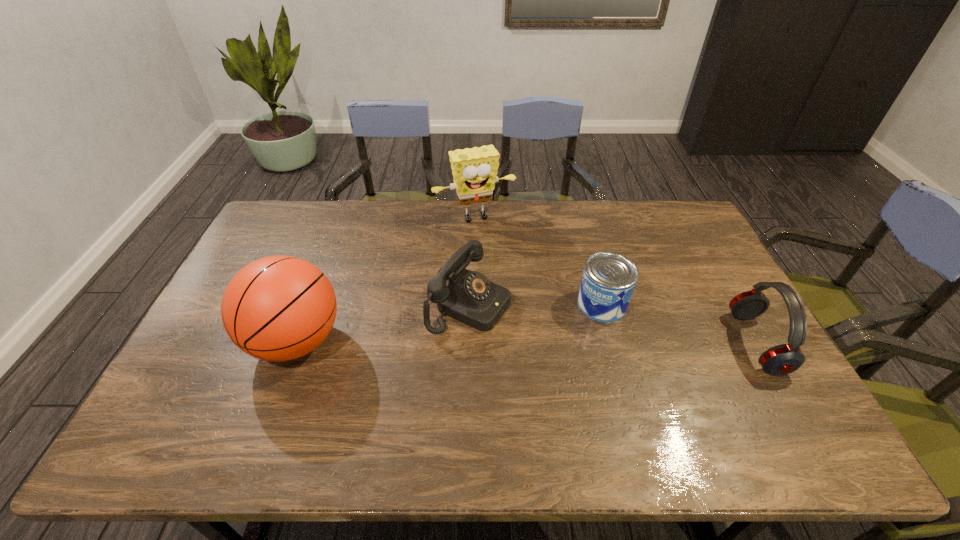
This screenshot has width=960, height=540. I want to click on blank region between the earphone and the fourth object from left to right, so click(679, 323).

Find the location of a particular element. The height and width of the screenshot is (540, 960). vacant area that lies between the basketball and the telephone is located at coordinates (383, 322).

Image resolution: width=960 pixels, height=540 pixels. In order to click on free space between the earphone and the second object from right to left in this screenshot , I will do `click(679, 323)`.

Image resolution: width=960 pixels, height=540 pixels. In order to click on vacant point located between the leftmost object and the telephone in this screenshot , I will do `click(383, 322)`.

Locate an element on the screen. The height and width of the screenshot is (540, 960). free space between the telephone and the rightmost object is located at coordinates (612, 323).

Where is `empty location between the telephone and the rightmost object`? The height and width of the screenshot is (540, 960). empty location between the telephone and the rightmost object is located at coordinates (612, 323).

Where is `blank region between the leftmost object and the farthest object`? Image resolution: width=960 pixels, height=540 pixels. blank region between the leftmost object and the farthest object is located at coordinates (386, 279).

Find the location of a particular element. The height and width of the screenshot is (540, 960). free spot between the basketball and the shortest object is located at coordinates (449, 322).

Identify which object is located as the fourth nearest to the earphone. Please provide its 2D coordinates. Your answer should be formatted as a tuple, i.e. [(x, y)], where the tuple contains the x and y coordinates of a point satisfying the conditions above.

[(278, 308)]

Where is `object that is the fourth closest one to the telephone`? This screenshot has height=540, width=960. object that is the fourth closest one to the telephone is located at coordinates (783, 359).